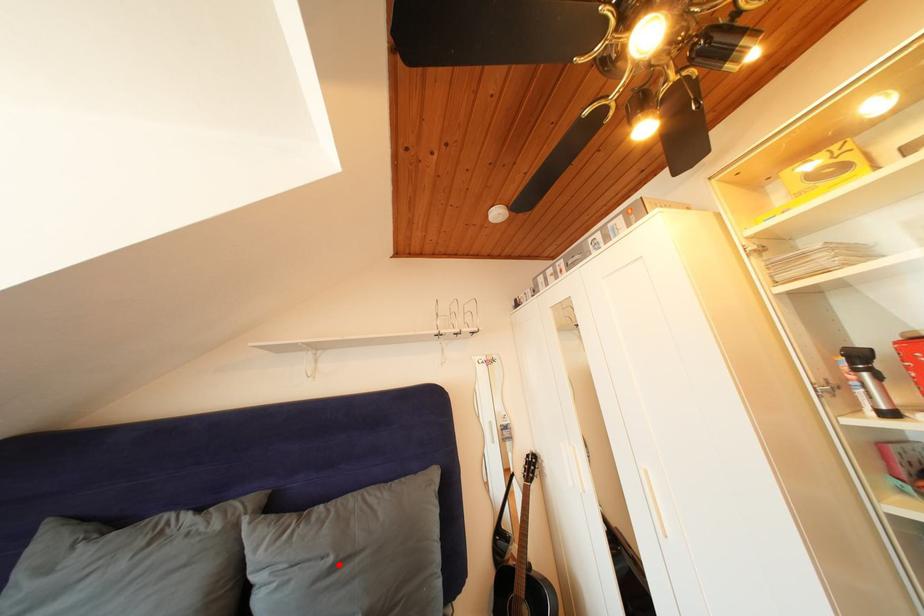
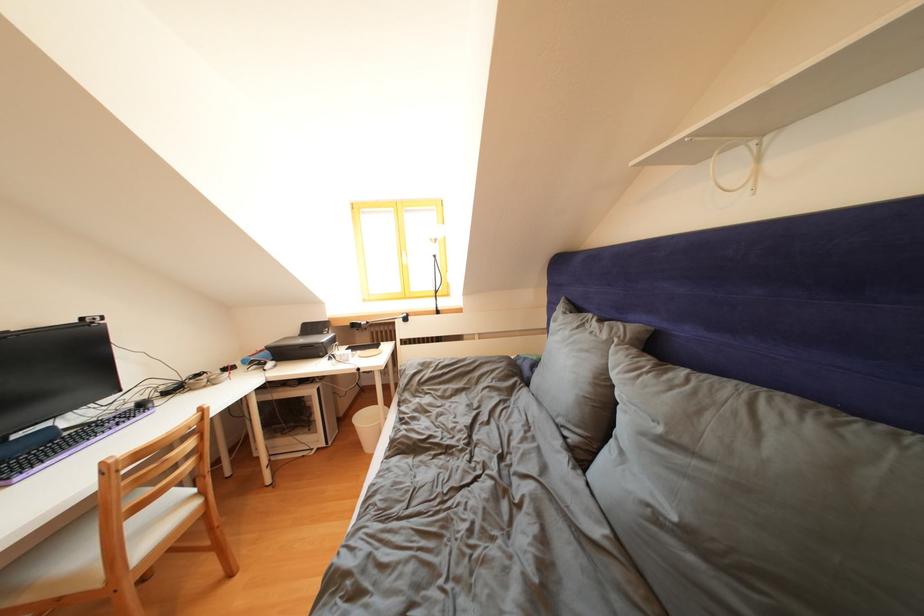
In the second image, find the point that corresponds to the highlighted location in the first image.

(667, 435)